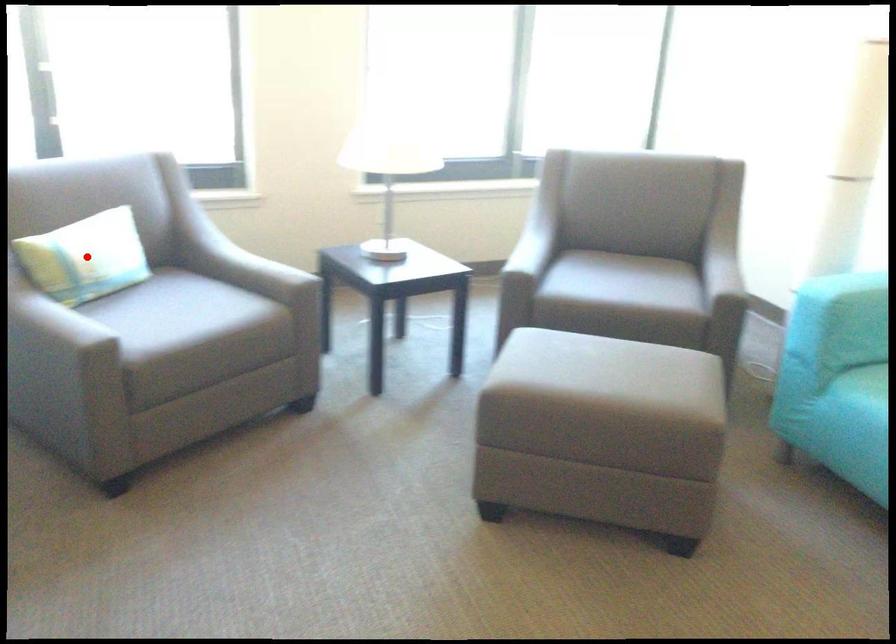
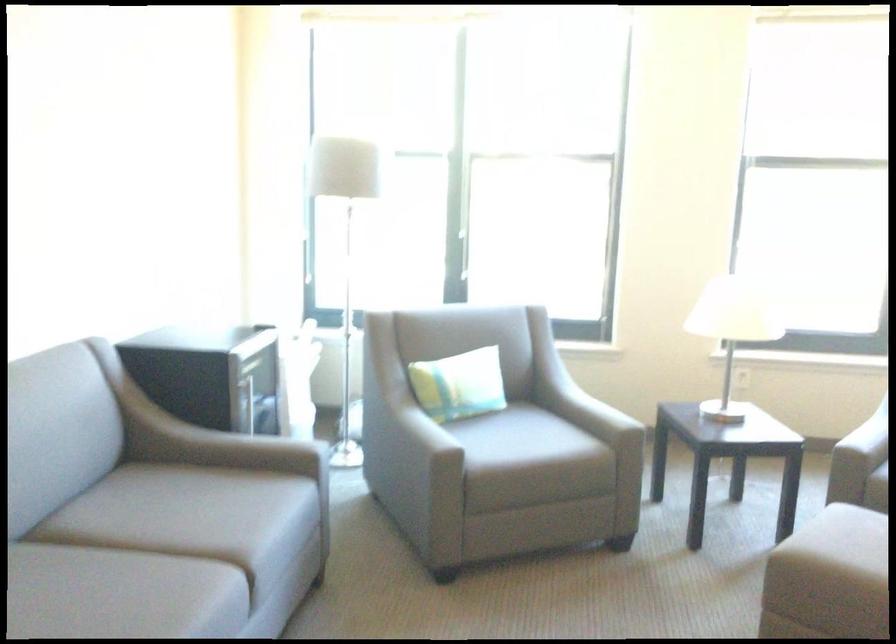
Question: I am providing you with two images of the same scene from different viewpoints. A red point is shown in image1. For the corresponding object point in image2, is it positioned nearer or farther from the camera?

Choices:
 (A) Nearer
 (B) Farther

Answer: (B)